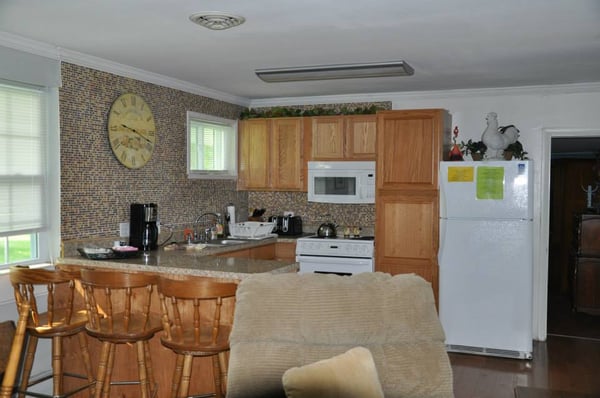
Where is `pillow`? This screenshot has width=600, height=398. pillow is located at coordinates (353, 383).